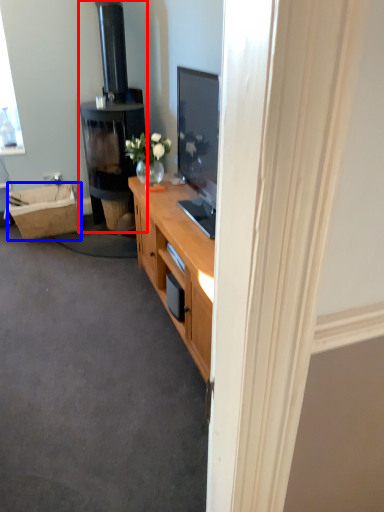
Question: Which point is further to the camera, fireplace (highlighted by a red box) or picnic basket (highlighted by a blue box)?

Choices:
 (A) fireplace
 (B) picnic basket

Answer: (B)